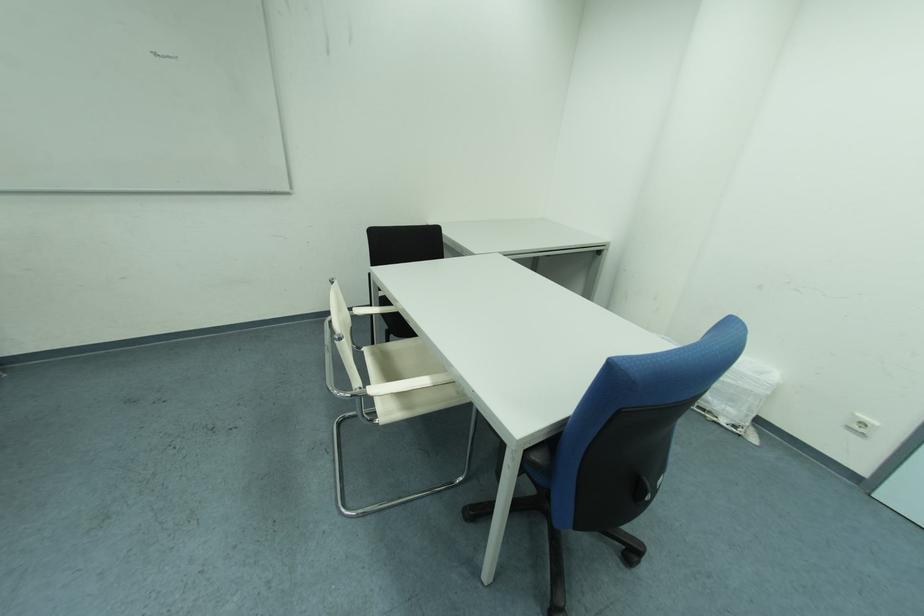
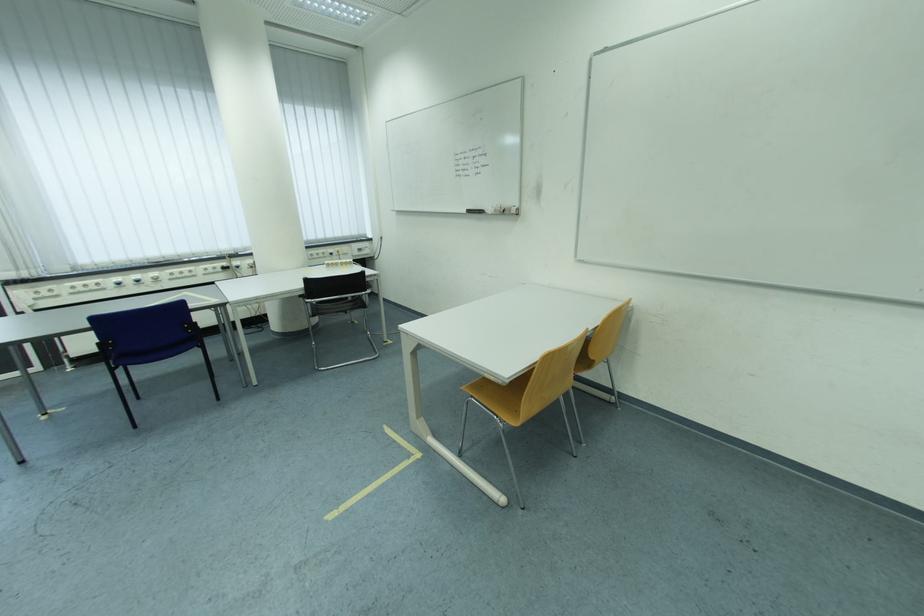
Question: Based on the continuous images, in which direction is the camera rotating? Reply with the corresponding letter.

Choices:
 (A) Left
 (B) Right
 (C) Up
 (D) Down

Answer: (A)